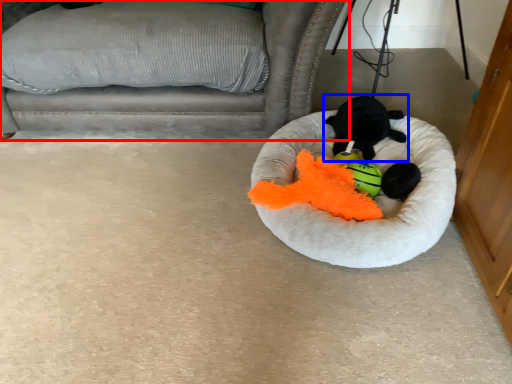
Question: Which point is further to the camera, furniture (highlighted by a red box) or toy (highlighted by a blue box)?

Choices:
 (A) furniture
 (B) toy

Answer: (B)